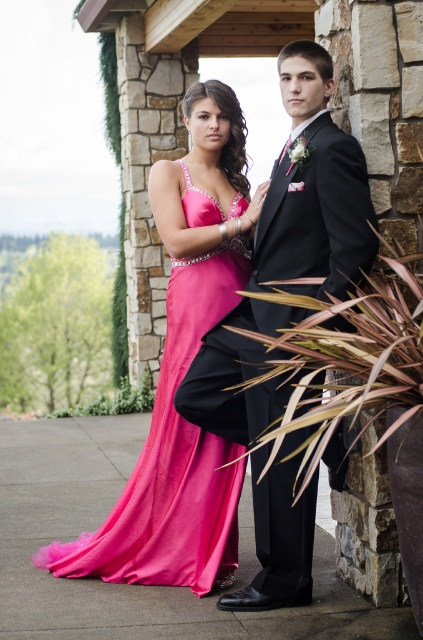
Question: Which point is closer to the camera?

Choices:
 (A) shiny satin gown at center
 (B) shiny black suit at center

Answer: (B)

Question: Is shiny black suit at center thinner than shiny satin gown at center?

Choices:
 (A) yes
 (B) no

Answer: (A)

Question: Does shiny black suit at center have a larger size compared to shiny satin gown at center?

Choices:
 (A) yes
 (B) no

Answer: (B)

Question: Which point is farther to the camera?

Choices:
 (A) (307, 499)
 (B) (206, 499)

Answer: (B)

Question: Does shiny black suit at center appear over shiny satin gown at center?

Choices:
 (A) yes
 (B) no

Answer: (A)